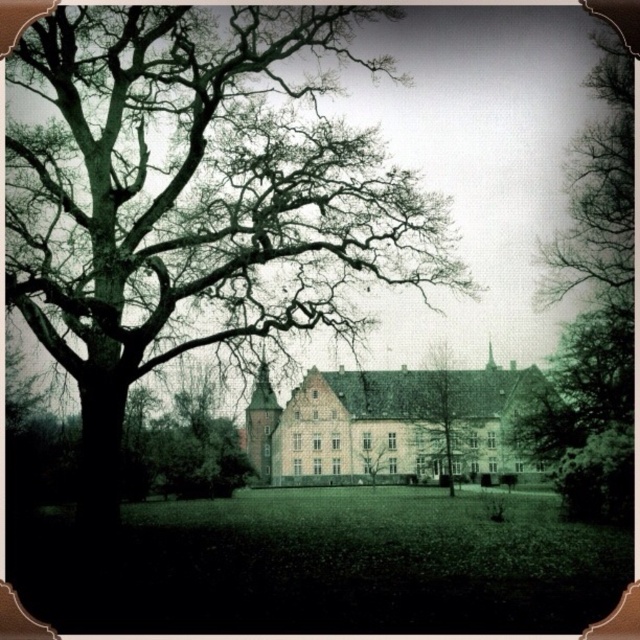
Is the position of dark green textured tree at left less distant than that of green leafy tree at center?

Yes, it is in front of green leafy tree at center.

Is dark green textured tree at left smaller than green leafy tree at center?

No.

Does point (336, 132) lie behind point (374, 452)?

No, (336, 132) is in front of (374, 452).

Locate an element on the screen. The height and width of the screenshot is (640, 640). dark green textured tree at left is located at coordinates (195, 198).

Does dark green textured tree at left have a larger size compared to smooth bark tree at center?

Yes, dark green textured tree at left is bigger than smooth bark tree at center.

Who is higher up, dark green textured tree at left or smooth bark tree at center?

dark green textured tree at left is higher up.

Which is behind, point (141, 129) or point (472, 419)?

The point (472, 419) is more distant.

Find the location of a particular element. This screenshot has width=640, height=640. dark green textured tree at left is located at coordinates (195, 198).

Where is `green leafy tree at right`? This screenshot has width=640, height=640. green leafy tree at right is located at coordinates tap(593, 314).

Between green leafy tree at right and green leafy tree at center, which one is positioned lower?

green leafy tree at center

The height and width of the screenshot is (640, 640). What do you see at coordinates (593, 314) in the screenshot?
I see `green leafy tree at right` at bounding box center [593, 314].

Where is `green leafy tree at right`? green leafy tree at right is located at coordinates (593, 314).